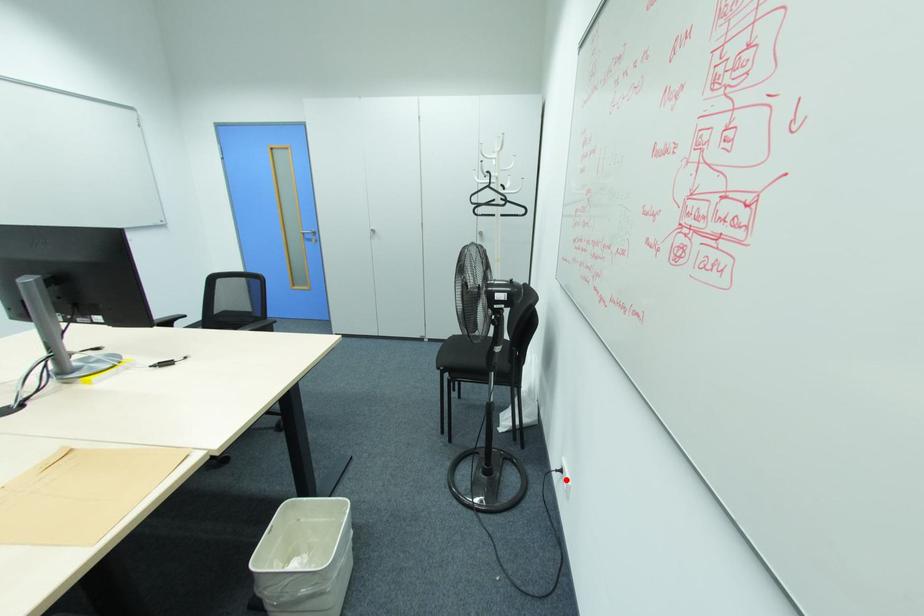
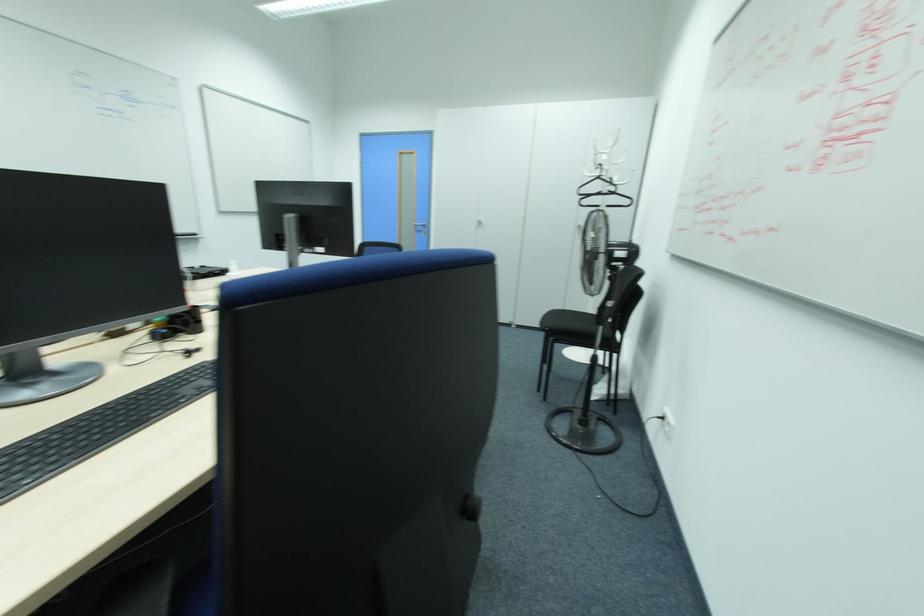
Question: I am providing you with two images of the same scene from different viewpoints. A red point is marked on the first image. At the location where the point appears in image 1, is it still visible in image 2?

Choices:
 (A) Yes
 (B) No

Answer: (A)